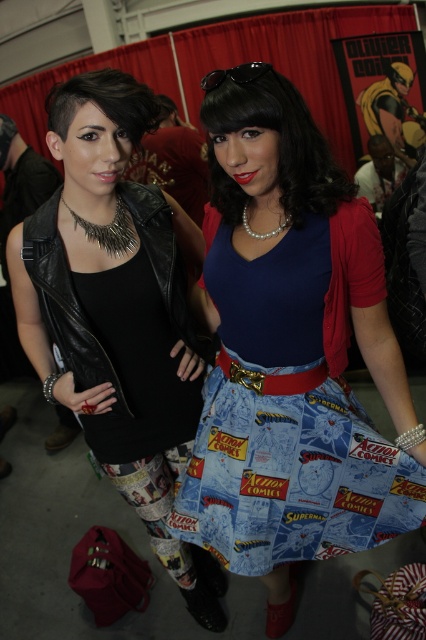
You are trying to decide which item to purchase between the matte black vest at left and the black leather jacket at left. Based on their sizes in the image, which one would you choose if you prefer a longer, more elongated look?

The matte black vest at left is much taller as the black leather jacket at left, so if you prefer a longer, more elongated look, you should choose the matte black vest at left.